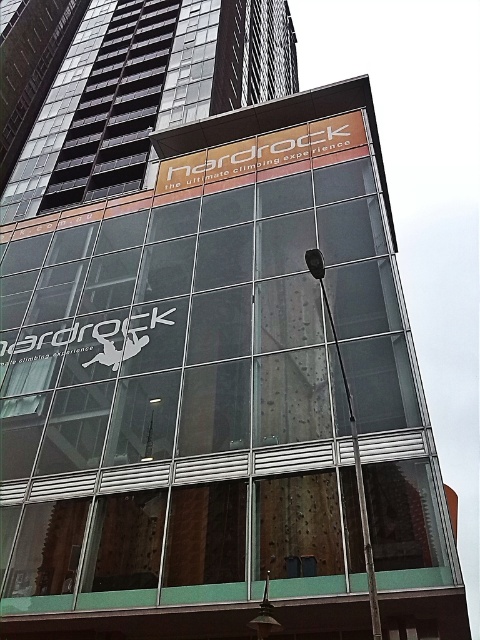
You are a city planner reviewing the building facade. The orange matte sign at upper center and the black metallic pole at upper center are both at the same height. Which object is wider?

The orange matte sign at upper center is wider than the black metallic pole at upper center because its width surpasses the pole.

You are a delivery person approaching the Hardrock building and need to locate the entrance. You see the orange matte sign at upper center and the black metallic pole at upper center. Which object is located to the left when facing the building?

The orange matte sign at upper center is positioned on the left side of the black metallic pole at upper center, so when facing the building, the orange matte sign at upper center is to the left of the black metallic pole at upper center.

You are standing in front of the Hardrock building and want to take a photo of the point at coordinate (194, 184). If your camera can focus on objects within 15 meters, will it be able to capture the point clearly?

The distance of point (194, 184) from the camera is 14.93 meters, which is within the camera focus range of 15 meters. Therefore, the camera can capture the point clearly.